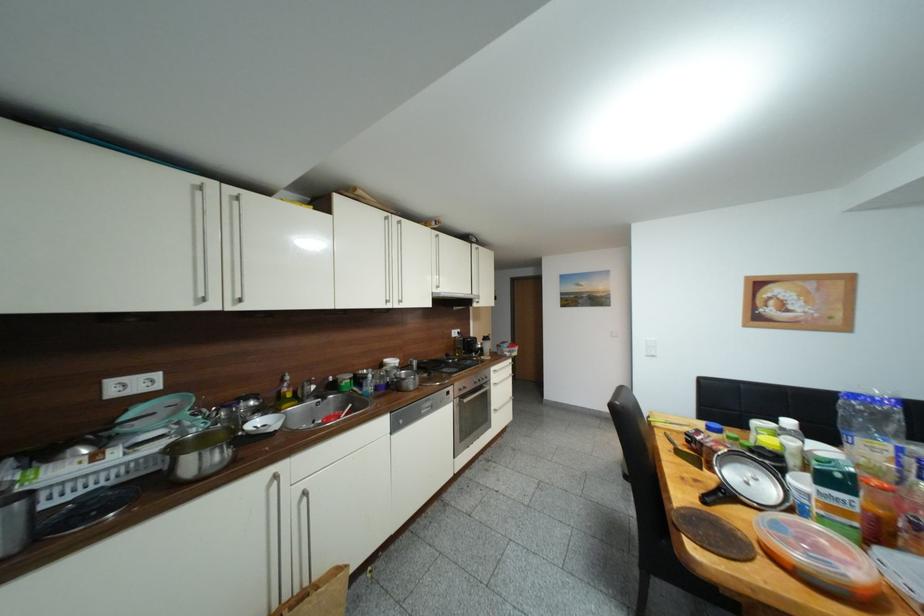
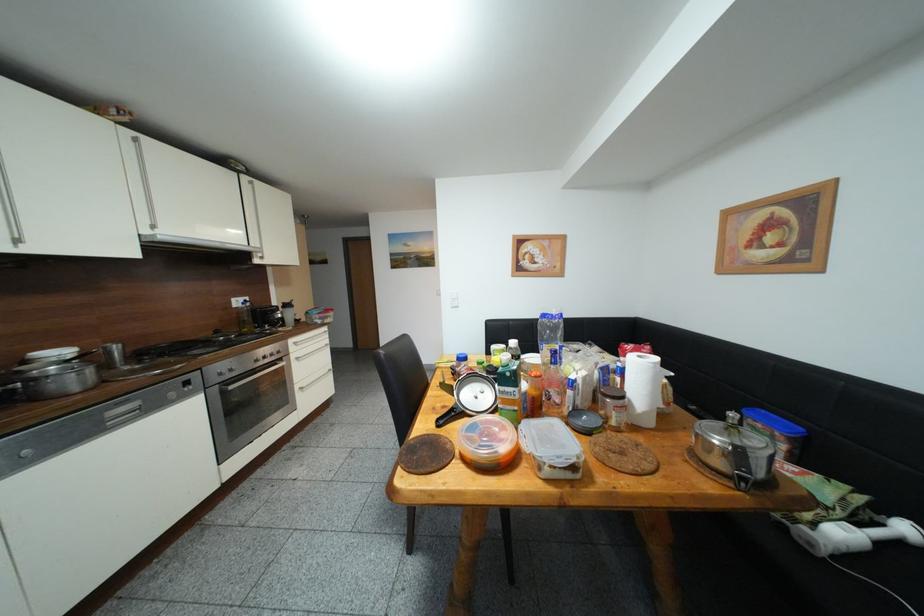
Question: Based on the continuous images, in which direction is the camera rotating? Reply with the corresponding letter.

Choices:
 (A) Left
 (B) Right
 (C) Up
 (D) Down

Answer: (B)